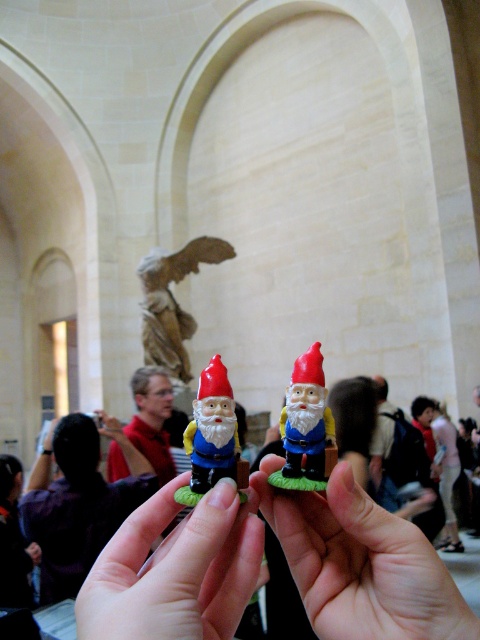
Who is more distant from viewer, (205,572) or (303,413)?

Positioned behind is point (303,413).

Does point (220, 600) lie behind point (319, 464)?

That is False.

Locate an element on the screen. smooth plastic hands at center is located at coordinates (176, 570).

Does smooth plastic hand at center appear under smooth plastic hands at center?

Actually, smooth plastic hand at center is above smooth plastic hands at center.

Who is positioned more to the right, smooth plastic hand at center or smooth plastic hands at center?

From the viewer's perspective, smooth plastic hand at center appears more on the right side.

Between point (472, 628) and point (189, 586), which one is positioned behind?

The point (472, 628) is more distant.

Where is `smooth plastic hand at center`? smooth plastic hand at center is located at coordinates 360,563.

Can you confirm if plastic gnome at center is positioned above matte plastic gnome at center?

Incorrect, plastic gnome at center is not positioned above matte plastic gnome at center.

Can you confirm if plastic gnome at center is wider than matte plastic gnome at center?

Correct, the width of plastic gnome at center exceeds that of matte plastic gnome at center.

Between point (206, 438) and point (317, 372), which one is positioned in front?

Point (317, 372) is more forward.

At what (x,y) coordinates should I click in order to perform the action: click on plastic gnome at center. Please return your answer as a coordinate pair (x, y). The image size is (480, 640). Looking at the image, I should click on (211, 435).